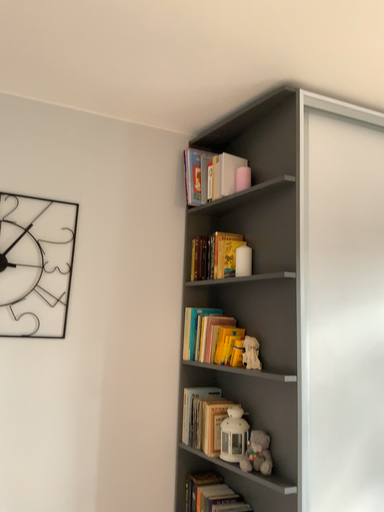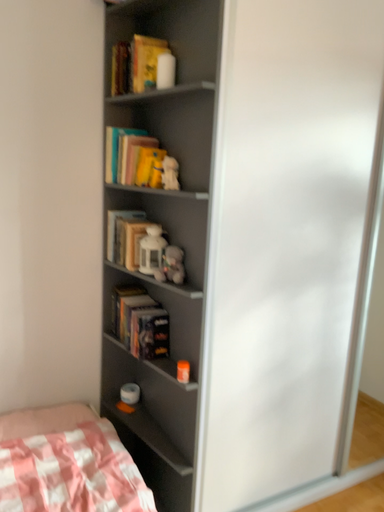
Question: Which way did the camera rotate in the video?

Choices:
 (A) rotated downward
 (B) rotated upward

Answer: (A)